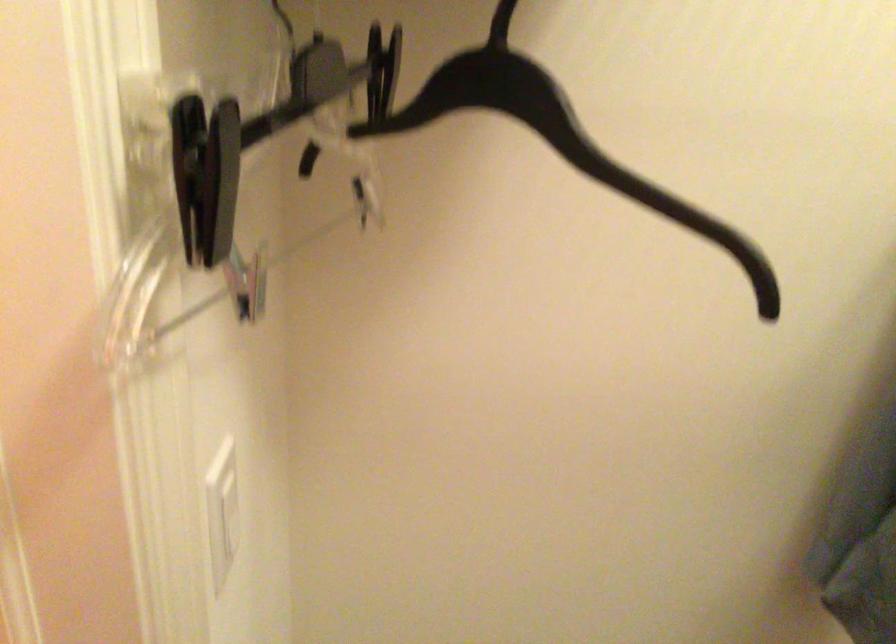
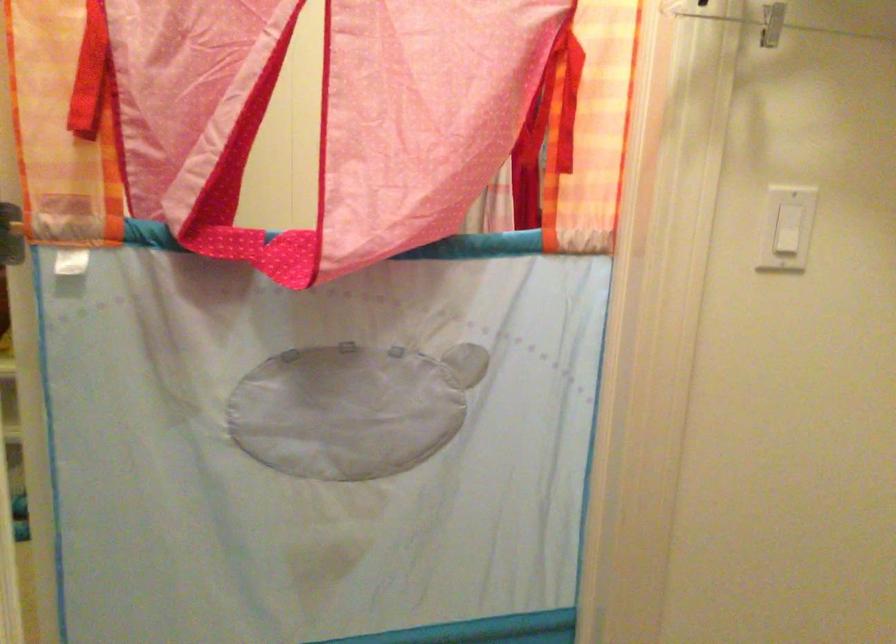
Find the pixel in the second image that matches point 231,500 in the first image.

(787, 230)